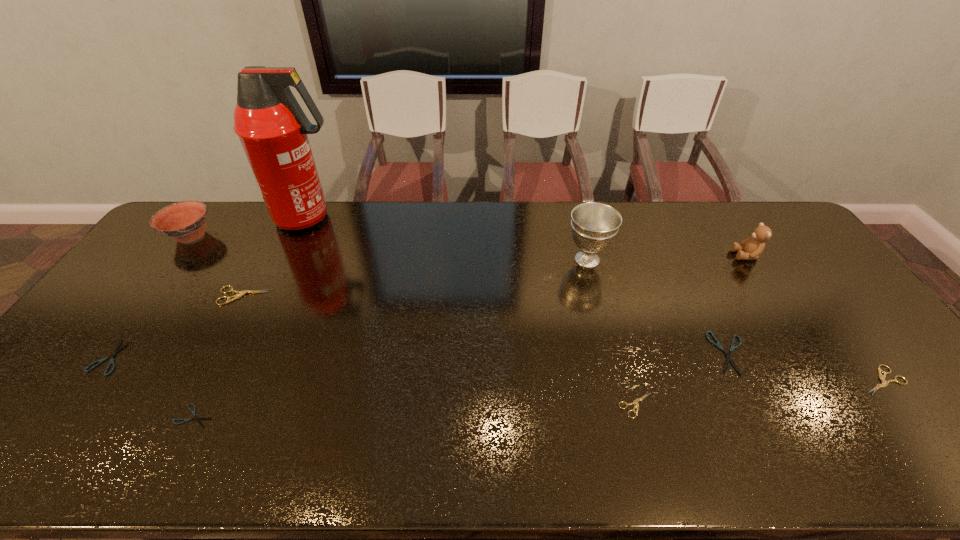
I want to click on free space at the far right corner, so click(782, 241).

Locate an element on the screen. The image size is (960, 540). vacant space at the near right corner is located at coordinates (918, 433).

This screenshot has height=540, width=960. I want to click on vacant space that's between the rightmost shears and the brown teddy bear, so click(x=814, y=318).

The image size is (960, 540). Find the location of `vacant space that is in between the second tallest object and the second black shears from right to left`. vacant space that is in between the second tallest object and the second black shears from right to left is located at coordinates click(x=391, y=338).

You are a GUI agent. You are given a task and a screenshot of the screen. Output one action in this format:
    pyautogui.click(x=<x>, y=<y>)
    Task: Click on the free space between the tallest object and the nearest black shears
    
    Given the screenshot: What is the action you would take?
    pyautogui.click(x=252, y=317)

At what (x,y) coordinates should I click in order to perform the action: click on free area in between the sixth shortest object and the teddy bear. Please return your answer as a coordinate pair (x, y). The image size is (960, 540). Looking at the image, I should click on (495, 275).

Identify the location of free space that is in between the red fire extinguisher and the rightmost beige shears. (595, 299).

Where is `empty space that is in between the rightmost object and the leftmost black shears`? empty space that is in between the rightmost object and the leftmost black shears is located at coordinates (495, 368).

You are a GUI agent. You are given a task and a screenshot of the screen. Output one action in this format:
    pyautogui.click(x=<x>, y=<y>)
    Task: Click on the vacant point located between the rightmost beige shears and the second tallest object
    The width and height of the screenshot is (960, 540).
    Given the screenshot: What is the action you would take?
    pyautogui.click(x=734, y=320)

I want to click on free space between the smallest beige shears and the fourth tallest object, so click(413, 321).